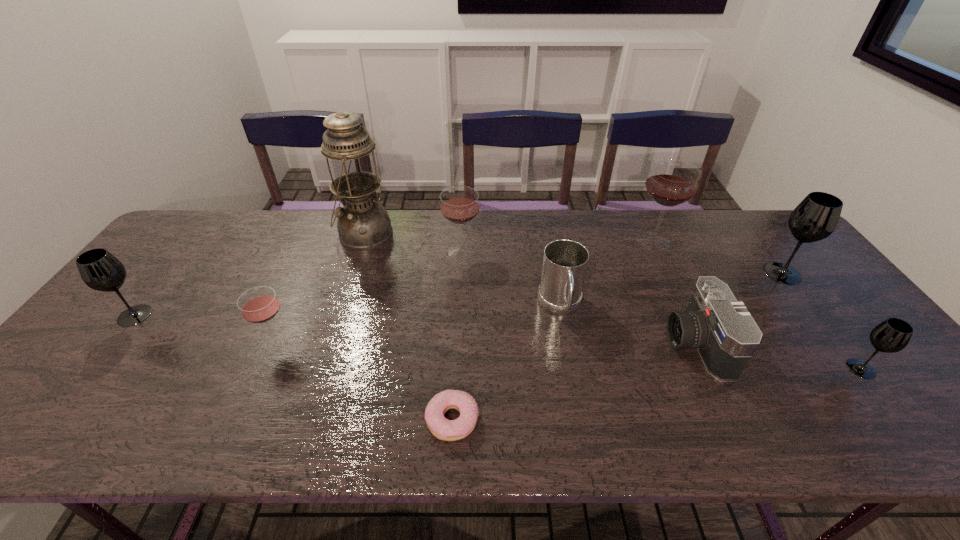
This screenshot has width=960, height=540. I want to click on gray wineglass that is the second closest to the second biggest gray wineglass, so click(892, 335).

Identify which gray wineglass is the nearest to the nearest gray wineglass. Please provide its 2D coordinates. Your answer should be formatted as a tuple, i.e. [(x, y)], where the tuple contains the x and y coordinates of a point satisfying the conditions above.

[(816, 217)]

Select which red wineglass appears as the third closest to the tallest object. Please provide its 2D coordinates. Your answer should be formatted as a tuple, i.e. [(x, y)], where the tuple contains the x and y coordinates of a point satisfying the conditions above.

[(671, 182)]

The image size is (960, 540). Identify the location of the second closest red wineglass relative to the smallest red wineglass. (671, 182).

Where is `vacant point that satisfies the following two spatial constraints: 1. on the side of the gray mug with the handle; 2. on the left side of the smallest gray wineglass`? This screenshot has height=540, width=960. vacant point that satisfies the following two spatial constraints: 1. on the side of the gray mug with the handle; 2. on the left side of the smallest gray wineglass is located at coordinates (572, 369).